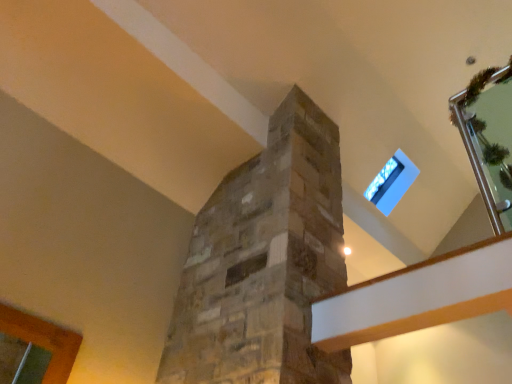
Question: Considering their positions, is transparent glass window at upper right located in front of or behind clear glass door at upper right?

Choices:
 (A) front
 (B) behind

Answer: (B)

Question: Looking at the image, does transparent glass window at upper right seem bigger or smaller compared to clear glass door at upper right?

Choices:
 (A) big
 (B) small

Answer: (B)

Question: Considering the positions of transparent glass window at upper right and clear glass door at upper right in the image, is transparent glass window at upper right taller or shorter than clear glass door at upper right?

Choices:
 (A) tall
 (B) short

Answer: (B)

Question: From the image's perspective, relative to transparent glass window at upper right, is clear glass door at upper right above or below?

Choices:
 (A) above
 (B) below

Answer: (A)

Question: Based on their positions, is clear glass door at upper right located to the left or right of transparent glass window at upper right?

Choices:
 (A) left
 (B) right

Answer: (B)

Question: Relative to transparent glass window at upper right, is clear glass door at upper right in front or behind?

Choices:
 (A) behind
 (B) front

Answer: (B)

Question: From their relative heights in the image, would you say clear glass door at upper right is taller or shorter than transparent glass window at upper right?

Choices:
 (A) short
 (B) tall

Answer: (B)